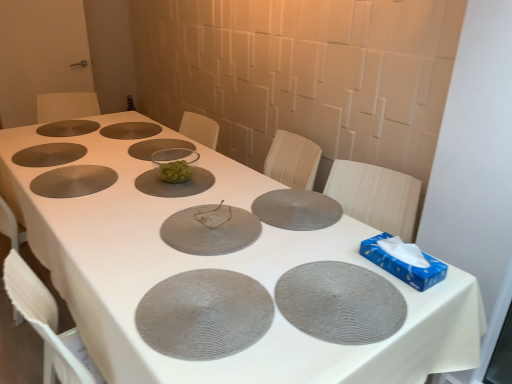
Locate an element on the screen. vacant space that's between matte gray plate at upper left, positioned as the fourth glass plate in back-to-front order, and clear glass bowl at center, acting as the 5th glass plate starting from the back is located at coordinates (93, 166).